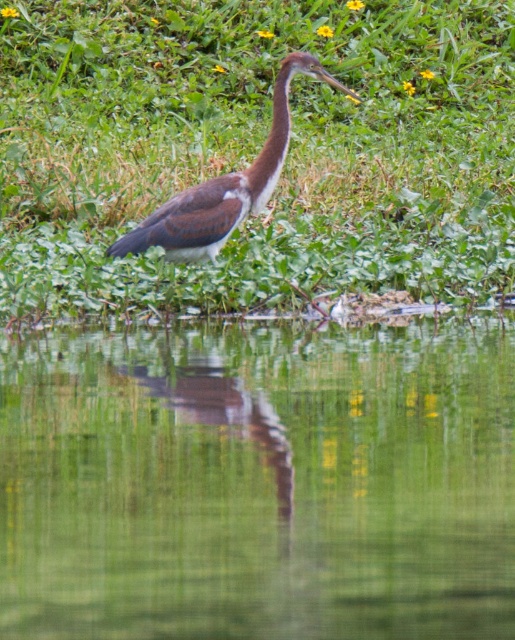
You are a photographer trying to capture the Tricolored Heron in the scene. You notice the green reflective water at center and the green leafy grass at center. Which of these two elements takes up more space in the frame?

The green leafy grass at center takes up more space in the frame because the green reflective water at center is smaller than green leafy grass at center.

You are a photographer aiming to capture the brown matte neck at center and the green leafy grass at center in the same frame. Based on their positions, which object should you adjust your camera to focus on first to ensure both are in the shot?

The green leafy grass at center is positioned on the left side of brown matte neck at center. To capture both in the same frame, focus on the brown matte neck at center first, as it is to the right of the green leafy grass at center, allowing the camera to encompass both objects by adjusting towards the right.